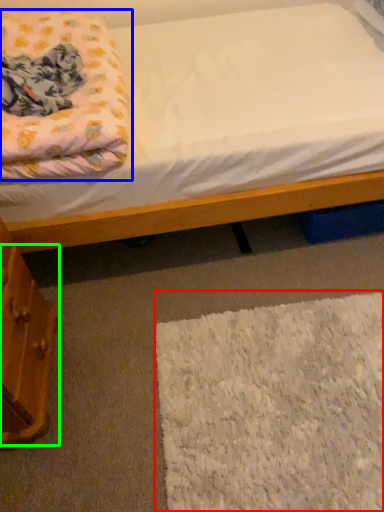
Question: Considering the real-world distances, which object is closest to mat (highlighted by a red box)? blanket (highlighted by a blue box) or drawer (highlighted by a green box).

Choices:
 (A) blanket
 (B) drawer

Answer: (B)